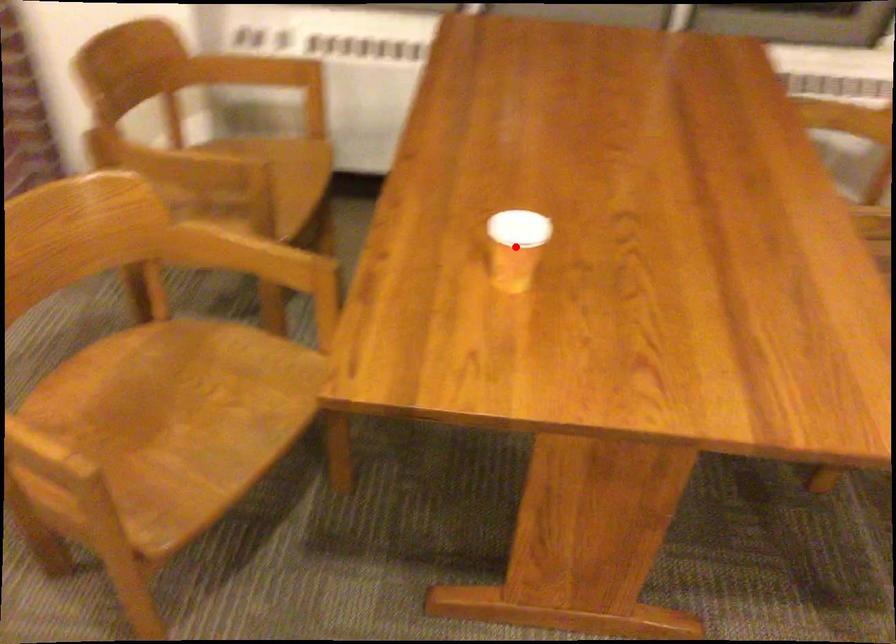
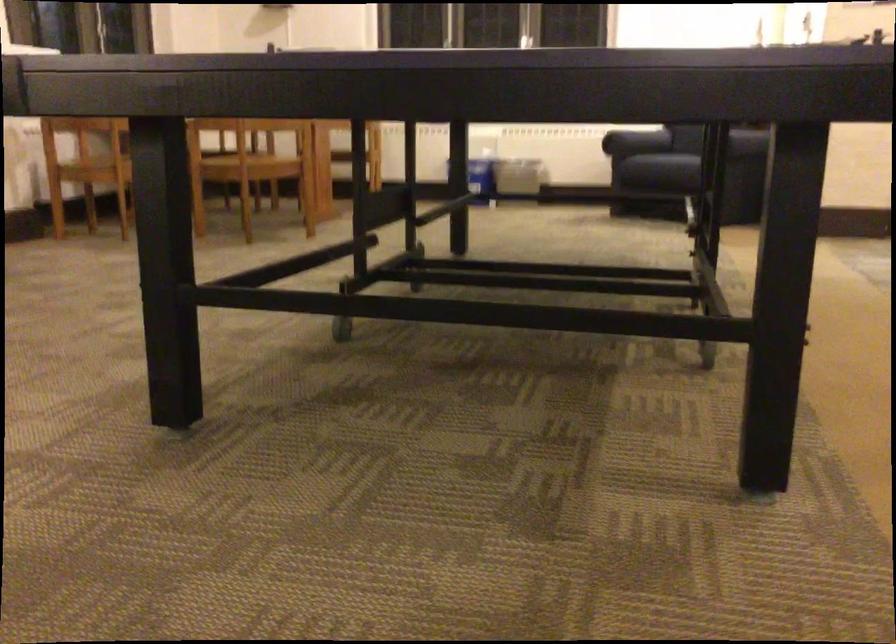
Question: I am providing you with two images of the same scene from different viewpoints. A red point is marked on the first image. Is the red point's position out of view in image 2?

Choices:
 (A) Yes
 (B) No

Answer: (A)